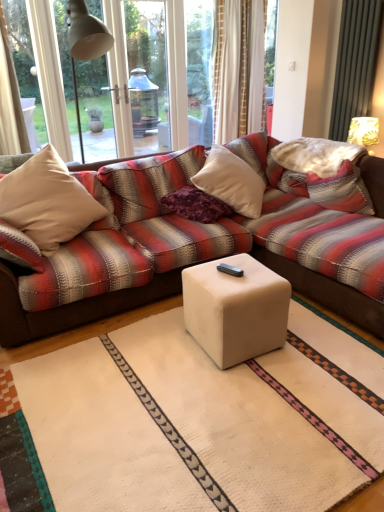
Question: Is purple textured pillow at center, the first pillow when ordered from left to right, positioned with its back to white fabric lampshade at upper right?

Choices:
 (A) yes
 (B) no

Answer: (B)

Question: From a real-world perspective, is purple textured pillow at center, placed as the 2th pillow when sorted from right to left, on top of white fabric lampshade at upper right?

Choices:
 (A) yes
 (B) no

Answer: (B)

Question: From a real-world perspective, is purple textured pillow at center, placed as the 2th pillow when sorted from right to left, positioned under white fabric lampshade at upper right based on gravity?

Choices:
 (A) yes
 (B) no

Answer: (A)

Question: Considering the relative sizes of purple textured pillow at center, the first pillow when ordered from left to right, and white fabric lampshade at upper right in the image provided, is purple textured pillow at center, the first pillow when ordered from left to right, wider than white fabric lampshade at upper right?

Choices:
 (A) yes
 (B) no

Answer: (A)

Question: Is purple textured pillow at center, placed as the 2th pillow when sorted from right to left, at the right side of white fabric lampshade at upper right?

Choices:
 (A) no
 (B) yes

Answer: (A)

Question: Is point (369, 121) closer or farther from the camera than point (283, 304)?

Choices:
 (A) closer
 (B) farther

Answer: (B)

Question: Looking at the image, does white fabric lampshade at upper right seem bigger or smaller compared to white matte cube at center?

Choices:
 (A) big
 (B) small

Answer: (B)

Question: In terms of height, does white fabric lampshade at upper right look taller or shorter compared to white matte cube at center?

Choices:
 (A) tall
 (B) short

Answer: (B)

Question: Visually, is white fabric lampshade at upper right positioned to the left or to the right of white matte cube at center?

Choices:
 (A) left
 (B) right

Answer: (B)

Question: In the image, is striped fabric pillow at right, marked as the first pillow in a right-to-left arrangement, positioned in front of or behind purple textured pillow at center, the first pillow when ordered from left to right?

Choices:
 (A) behind
 (B) front

Answer: (B)

Question: Is point (367, 199) closer or farther from the camera than point (172, 201)?

Choices:
 (A) farther
 (B) closer

Answer: (A)

Question: In terms of width, does striped fabric pillow at right, positioned as the second pillow in left-to-right order, look wider or thinner when compared to purple textured pillow at center, the first pillow when ordered from left to right?

Choices:
 (A) thin
 (B) wide

Answer: (A)

Question: In terms of height, does striped fabric pillow at right, positioned as the second pillow in left-to-right order, look taller or shorter compared to purple textured pillow at center, the first pillow when ordered from left to right?

Choices:
 (A) tall
 (B) short

Answer: (A)

Question: From a real-world perspective, relative to white fabric lampshade at upper right, is purple textured pillow at center, placed as the 2th pillow when sorted from right to left, vertically above or below?

Choices:
 (A) below
 (B) above

Answer: (A)

Question: Does point (215, 210) appear closer or farther from the camera than point (355, 117)?

Choices:
 (A) farther
 (B) closer

Answer: (B)